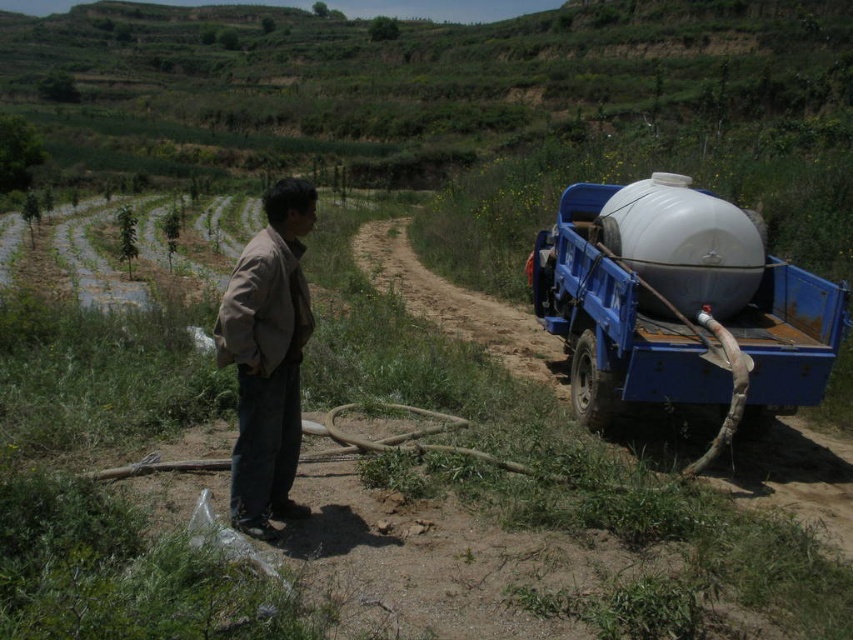
Is point (801, 273) in front of point (292, 349)?

No.

Does white glossy tank at right have a lesser width compared to brown cotton jacket at center?

No, white glossy tank at right is not thinner than brown cotton jacket at center.

Is point (659, 365) farther from viewer compared to point (288, 451)?

Yes.

At what (x,y) coordinates should I click in order to perform the action: click on white glossy tank at right. Please return your answer as a coordinate pair (x, y). Looking at the image, I should click on (679, 305).

Can you confirm if white glossy tank at right is taller than white matte water tank at right?

Indeed, white glossy tank at right has a greater height compared to white matte water tank at right.

Does point (590, 307) come in front of point (717, 196)?

No, (590, 307) is behind (717, 196).

Locate an element on the screen. The image size is (853, 640). white glossy tank at right is located at coordinates (679, 305).

Which is behind, point (270, 381) or point (637, 275)?

The point (637, 275) is behind.

Between brown cotton jacket at center and white matte water tank at right, which one is positioned higher?

white matte water tank at right is higher up.

Between point (279, 248) and point (608, 244), which one is positioned behind?

The point (608, 244) is more distant.

In order to click on brown cotton jacket at center in this screenshot , I will do `click(267, 358)`.